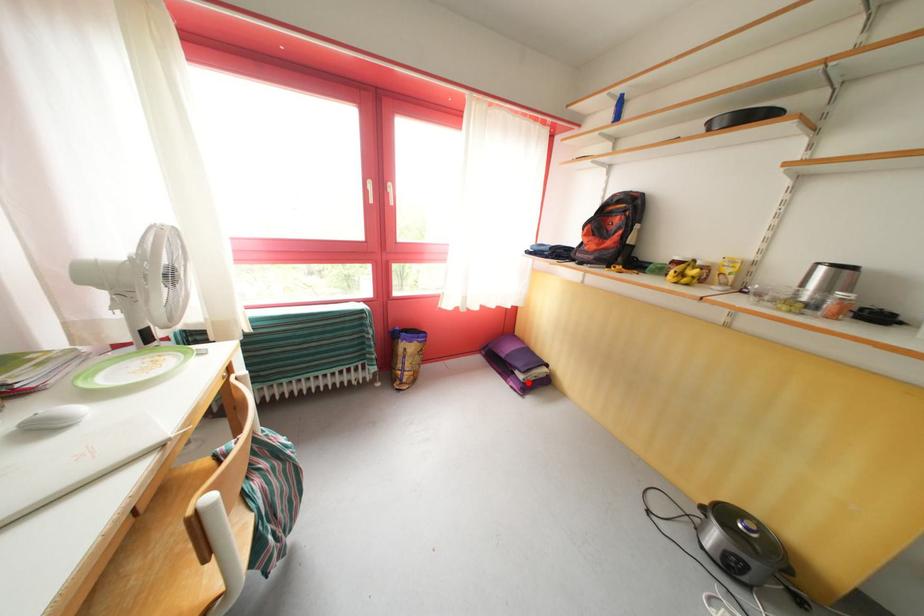
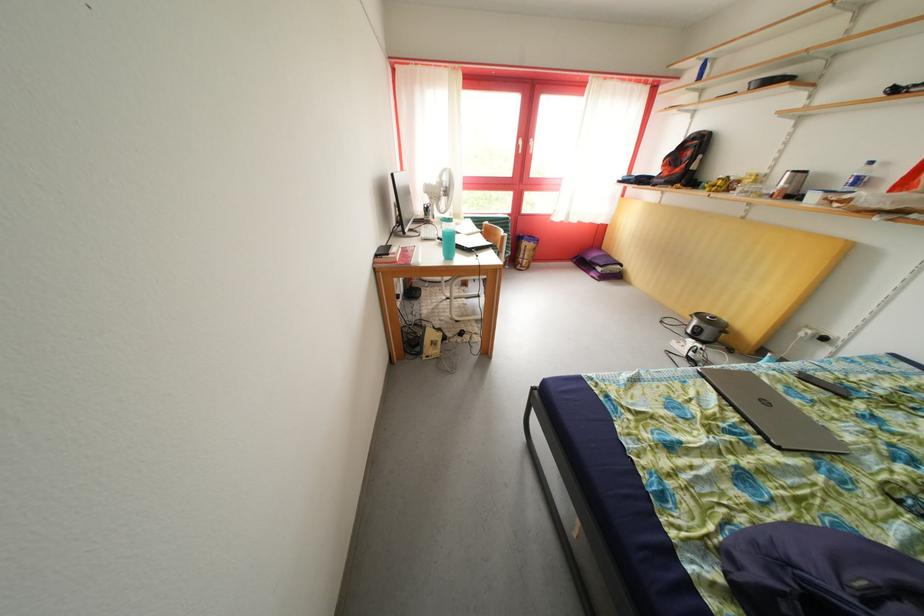
Question: I am providing you with two images of the same scene from different viewpoints. A red point is marked on the first image. At the location where the point appears in image 1, is it still visible in image 2?

Choices:
 (A) Yes
 (B) No

Answer: (A)